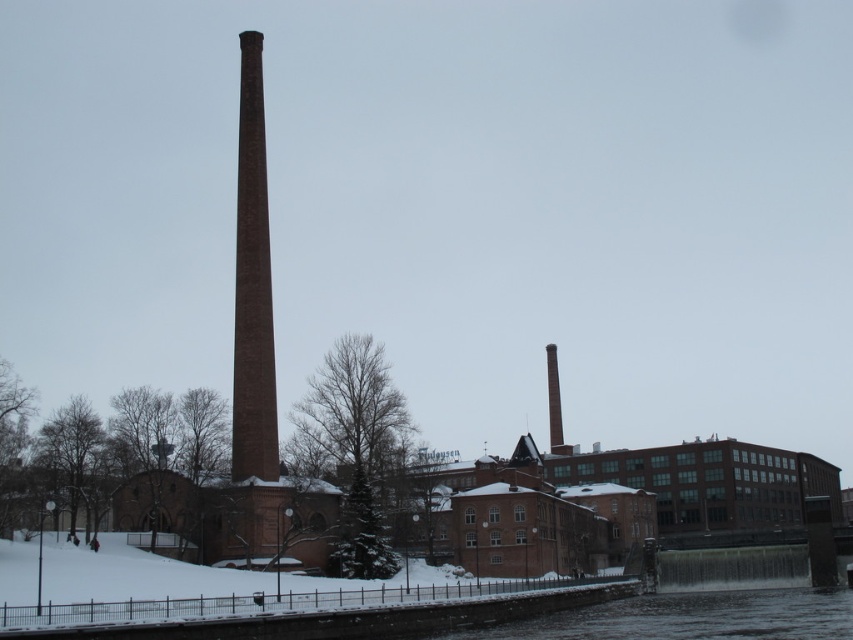
Does brown brick chimney at center have a lesser width compared to smooth brick chimney at center?

No.

Does point (244, 316) come farther from viewer compared to point (553, 400)?

No, it is not.

Locate an element on the screen. Image resolution: width=853 pixels, height=640 pixels. brown brick chimney at center is located at coordinates (252, 285).

The width and height of the screenshot is (853, 640). Identify the location of brown brick chimney at center. (252, 285).